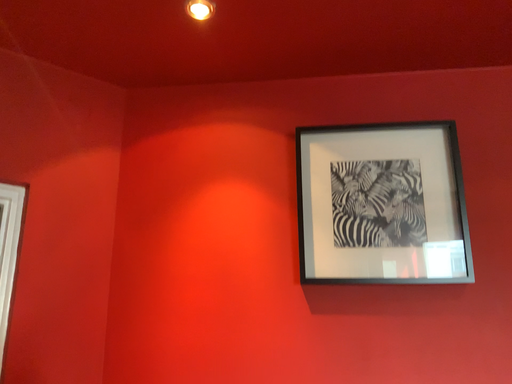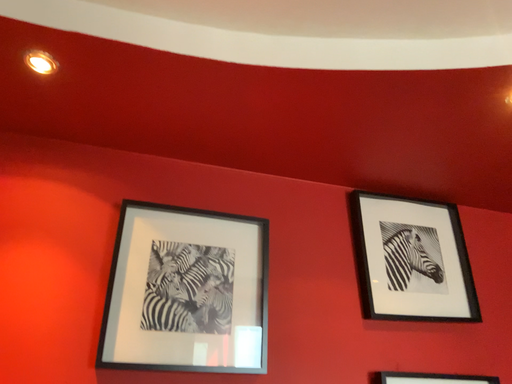
Question: How did the camera likely rotate when shooting the video?

Choices:
 (A) rotated downward
 (B) rotated upward

Answer: (B)